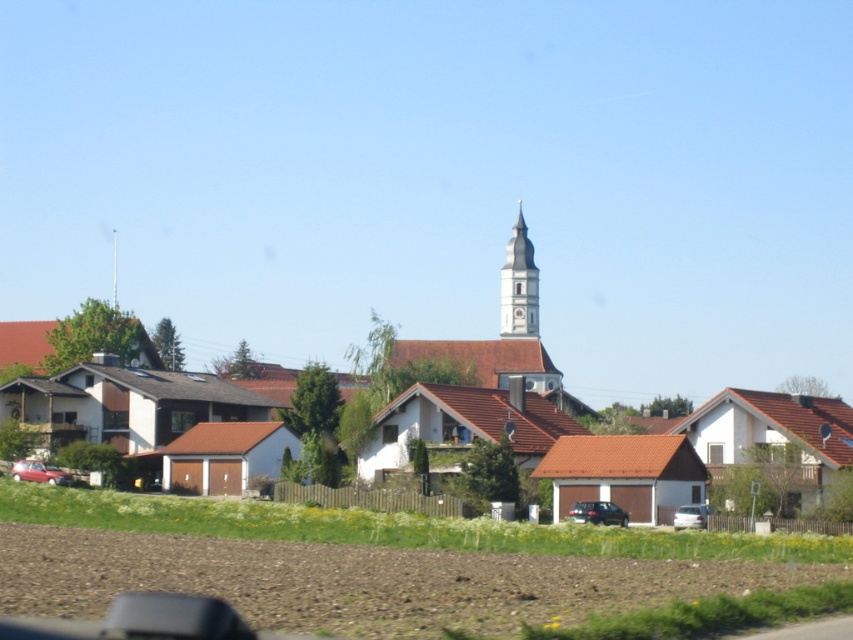
Does white matte house at center have a larger size compared to white stone bell tower at center?

Yes, white matte house at center is bigger than white stone bell tower at center.

Can you confirm if white matte house at center is positioned to the left of white stone bell tower at center?

Yes, white matte house at center is to the left of white stone bell tower at center.

Does point (86, 422) come in front of point (527, 298)?

Yes.

Where is `white matte house at center`? The image size is (853, 640). white matte house at center is located at coordinates (483, 394).

Can you confirm if white stone bell tower at center is taller than matte red car at lower left?

Correct, white stone bell tower at center is much taller as matte red car at lower left.

Between point (508, 292) and point (38, 465), which one is positioned in front?

Point (38, 465) is in front.

Where is `white stone bell tower at center`? white stone bell tower at center is located at coordinates (518, 285).

Where is `white stone bell tower at center`? white stone bell tower at center is located at coordinates (518, 285).

Does satin black suv at center have a lesser height compared to matte red car at lower left?

No, satin black suv at center is not shorter than matte red car at lower left.

Is point (608, 516) behind point (39, 468)?

No, it is not.

What do you see at coordinates (596, 513) in the screenshot?
I see `satin black suv at center` at bounding box center [596, 513].

Where is `satin black suv at center`? satin black suv at center is located at coordinates (596, 513).